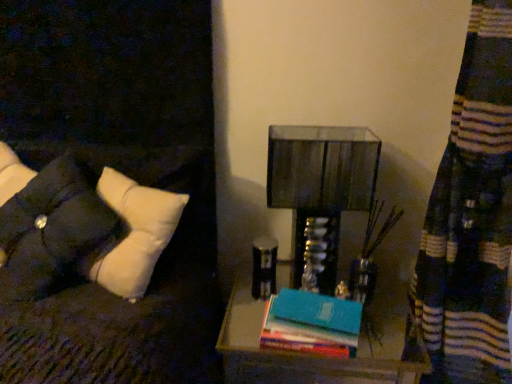
Question: Does tufted fabric pillow at left appear on the right side of wooden nightstand at lower right?

Choices:
 (A) no
 (B) yes

Answer: (A)

Question: Could you tell me if tufted fabric pillow at left is turned towards wooden nightstand at lower right?

Choices:
 (A) yes
 (B) no

Answer: (B)

Question: Is tufted fabric pillow at left thinner than wooden nightstand at lower right?

Choices:
 (A) no
 (B) yes

Answer: (B)

Question: Is tufted fabric pillow at left taller than wooden nightstand at lower right?

Choices:
 (A) no
 (B) yes

Answer: (A)

Question: Is tufted fabric pillow at left not close to wooden nightstand at lower right?

Choices:
 (A) yes
 (B) no

Answer: (B)

Question: Is white fabric pillow at left bigger or smaller than tufted fabric pillow at left?

Choices:
 (A) big
 (B) small

Answer: (A)

Question: Do you think white fabric pillow at left is within tufted fabric pillow at left, or outside of it?

Choices:
 (A) outside
 (B) inside

Answer: (A)

Question: From the image's perspective, relative to tufted fabric pillow at left, is white fabric pillow at left above or below?

Choices:
 (A) above
 (B) below

Answer: (B)

Question: From their relative heights in the image, would you say white fabric pillow at left is taller or shorter than tufted fabric pillow at left?

Choices:
 (A) short
 (B) tall

Answer: (A)

Question: Is wooden nightstand at lower right taller or shorter than tufted fabric pillow at left?

Choices:
 (A) tall
 (B) short

Answer: (A)

Question: Choose the correct answer: Is wooden nightstand at lower right inside tufted fabric pillow at left or outside it?

Choices:
 (A) outside
 (B) inside

Answer: (A)

Question: Considering the positions of wooden nightstand at lower right and tufted fabric pillow at left in the image, is wooden nightstand at lower right bigger or smaller than tufted fabric pillow at left?

Choices:
 (A) big
 (B) small

Answer: (A)

Question: From a real-world perspective, is wooden nightstand at lower right positioned above or below tufted fabric pillow at left?

Choices:
 (A) below
 (B) above

Answer: (A)

Question: From the image's perspective, relative to wooden nightstand at lower right, is white fabric pillow at left above or below?

Choices:
 (A) above
 (B) below

Answer: (A)

Question: Based on their sizes in the image, would you say white fabric pillow at left is bigger or smaller than wooden nightstand at lower right?

Choices:
 (A) big
 (B) small

Answer: (B)